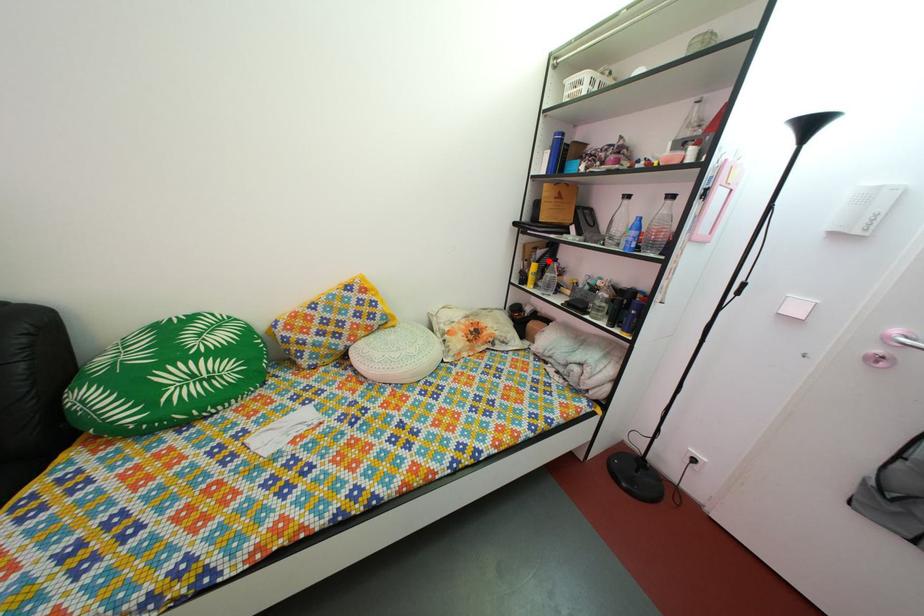
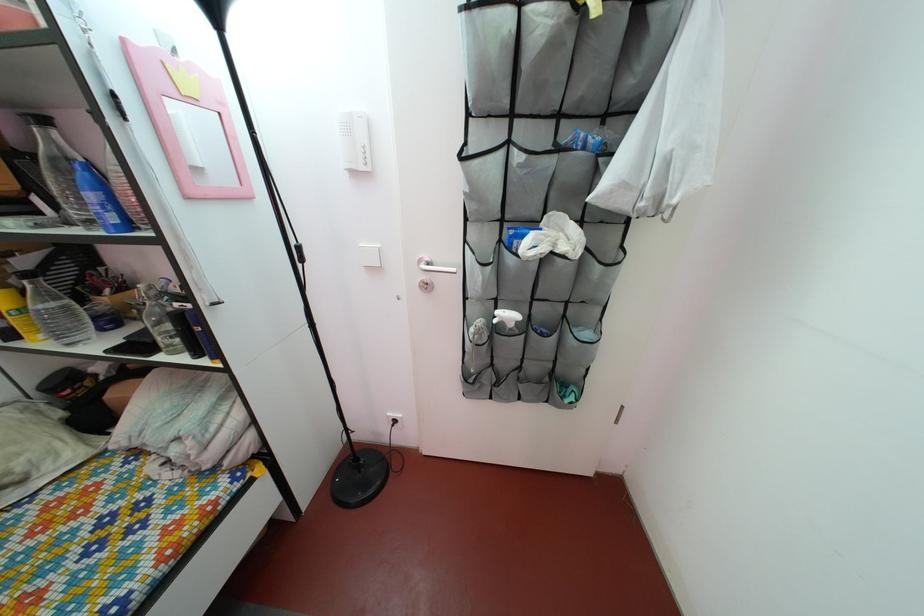
In the second image, find the point that corresponds to the highlighted location in the first image.

(32, 270)